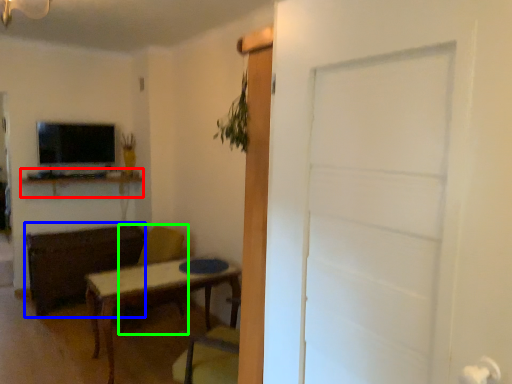
Question: Which is nearer to the computer desk (highlighted by a red box)? brown (highlighted by a blue box) or swivel chair (highlighted by a green box).

Choices:
 (A) brown
 (B) swivel chair

Answer: (A)